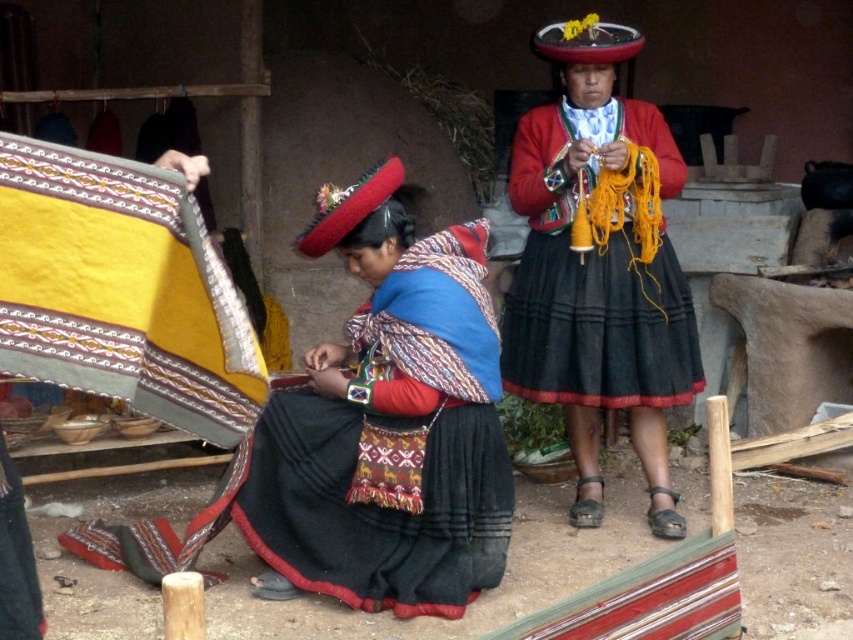
Consider the image. You are a fashion designer observing the two skirts in the image. Which of the two skirts, the black woven skirt at lower left or the matte black skirt at center, would you recommend for a client who wants a skirt that reaches higher on their body?

The black woven skirt at lower left is much taller than the matte black skirt at center, so it would be the better choice for a client seeking a skirt that reaches higher on their body.

You are designing a new collection and need to choose between two skirts for a runway show. The black woven skirt at lower left and the matte black skirt at center. Based on their widths, which one would you recommend for a model with a wider hips?

The black woven skirt at lower left might be wider than matte black skirt at center, so it would be more suitable for a model with wider hips.

You are a tourist visiting a weaving workshop and see two women working. The woman on the left wears a black skirt with red and white patterns at the hem. The woman on the right wears a red jacket with decorative patterns. Can you tell me which woman is closer to the point marked at coordinates [390,436]?

The black woven skirt at lower left is represented by point [390,436], so the woman on the left is closer to that point.